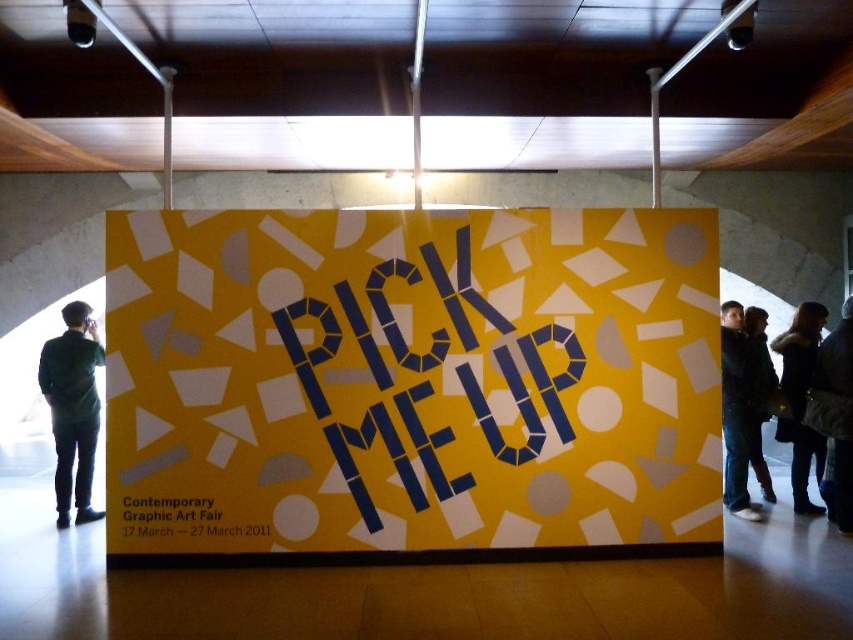
Question: Is dark green shirt at left above dark blue leather jacket at right?

Choices:
 (A) no
 (B) yes

Answer: (A)

Question: Is blue paper at center below dark blue leather jacket at right?

Choices:
 (A) yes
 (B) no

Answer: (B)

Question: Is dark green shirt at left thinner than black paper at lower left?

Choices:
 (A) no
 (B) yes

Answer: (B)

Question: Which point appears closest to the camera in this image?

Choices:
 (A) (155, 520)
 (B) (525, 378)
 (C) (328, 312)
 (D) (57, 380)

Answer: (A)

Question: Which object is closer to the camera taking this photo?

Choices:
 (A) yellow paper poster at center
 (B) dark green shirt at left
 (C) blue paper at center

Answer: (A)

Question: Which point is farther to the camera?

Choices:
 (A) (83, 316)
 (B) (817, 468)
 (C) (753, 371)

Answer: (B)